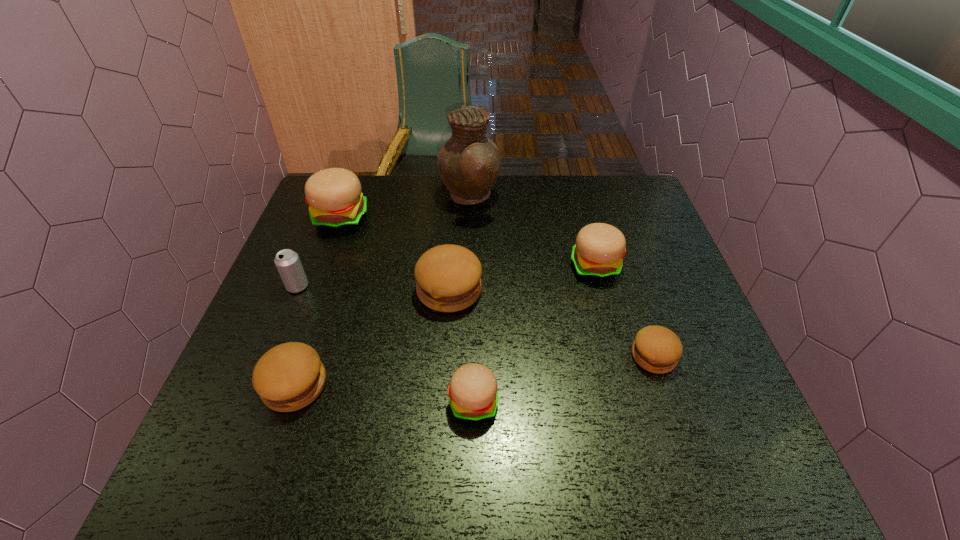
Locate an element on the screen. Image resolution: width=960 pixels, height=540 pixels. hamburger that is the fourth closest to the second nearest beige hamburger is located at coordinates (334, 196).

Choose which hamburger is the nearest neighbor to the second smallest brown hamburger. Please provide its 2D coordinates. Your answer should be formatted as a tuple, i.e. [(x, y)], where the tuple contains the x and y coordinates of a point satisfying the conditions above.

[(448, 277)]

I want to click on beige hamburger that is the nearest to the leftmost beige hamburger, so click(x=473, y=393).

Locate which beige hamburger ranks second in proximity to the second beige hamburger from left to right. Please provide its 2D coordinates. Your answer should be formatted as a tuple, i.e. [(x, y)], where the tuple contains the x and y coordinates of a point satisfying the conditions above.

[(334, 196)]

What are the coordinates of `brown hamburger that is the closest to the brown pitcher` in the screenshot? It's located at (448, 277).

Identify which brown hamburger is located as the second nearest to the shortest object. Please provide its 2D coordinates. Your answer should be formatted as a tuple, i.e. [(x, y)], where the tuple contains the x and y coordinates of a point satisfying the conditions above.

[(288, 377)]

Where is `free location that satisfies the following two spatial constraints: 1. on the back side of the second brown hamburger from left to right; 2. on the left side of the second nearest beige hamburger`? This screenshot has width=960, height=540. free location that satisfies the following two spatial constraints: 1. on the back side of the second brown hamburger from left to right; 2. on the left side of the second nearest beige hamburger is located at coordinates (451, 266).

Locate an element on the screen. This screenshot has width=960, height=540. free region that satisfies the following two spatial constraints: 1. at the spout of the brown pitcher; 2. on the back side of the second nearest beige hamburger is located at coordinates click(x=468, y=266).

I want to click on vacant space that satisfies the following two spatial constraints: 1. at the spout of the rightmost beige hamburger; 2. on the right side of the pitcher, so click(468, 266).